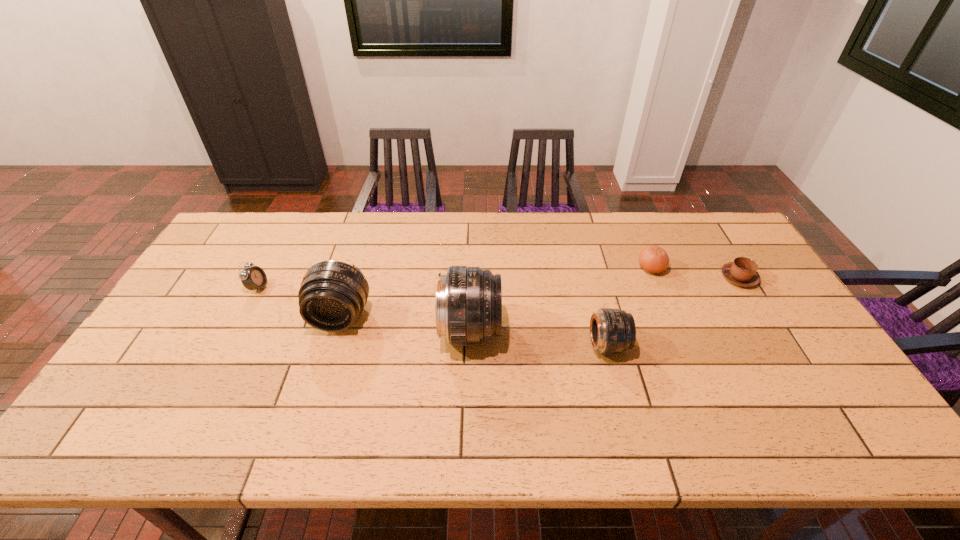
This screenshot has height=540, width=960. I want to click on unoccupied area between the cappuccino and the fourth shortest object, so click(x=673, y=312).

The image size is (960, 540). What are the coordinates of `empty space that is in between the second telephoto lens from right to left and the rightmost telephoto lens` in the screenshot? It's located at (539, 338).

Image resolution: width=960 pixels, height=540 pixels. Find the location of `free area in between the fourth tallest object and the fourth shortest object`. free area in between the fourth tallest object and the fourth shortest object is located at coordinates (433, 316).

Find the location of `object that is the closest to the cappuccino`. object that is the closest to the cappuccino is located at coordinates (653, 259).

Choose which object is the fifth nearest neighbor to the third object from left to right. Please provide its 2D coordinates. Your answer should be formatted as a tuple, i.e. [(x, y)], where the tuple contains the x and y coordinates of a point satisfying the conditions above.

[(742, 271)]

Choose which telephoto lens is the second nearest neighbor to the second telephoto lens from right to left. Please provide its 2D coordinates. Your answer should be formatted as a tuple, i.e. [(x, y)], where the tuple contains the x and y coordinates of a point satisfying the conditions above.

[(612, 331)]

Where is `telephoto lens that stands as the closest to the leftmost telephoto lens`? telephoto lens that stands as the closest to the leftmost telephoto lens is located at coordinates (468, 303).

Find the location of a particular element. vacant space that satisfies the following two spatial constraints: 1. on the side of the rightmost object with the handle; 2. at the front element of the second shortest telephoto lens is located at coordinates (763, 318).

I want to click on vacant area that satisfies the following two spatial constraints: 1. on the side of the shortest object with the handle; 2. at the front element of the second object from left to right, so click(763, 318).